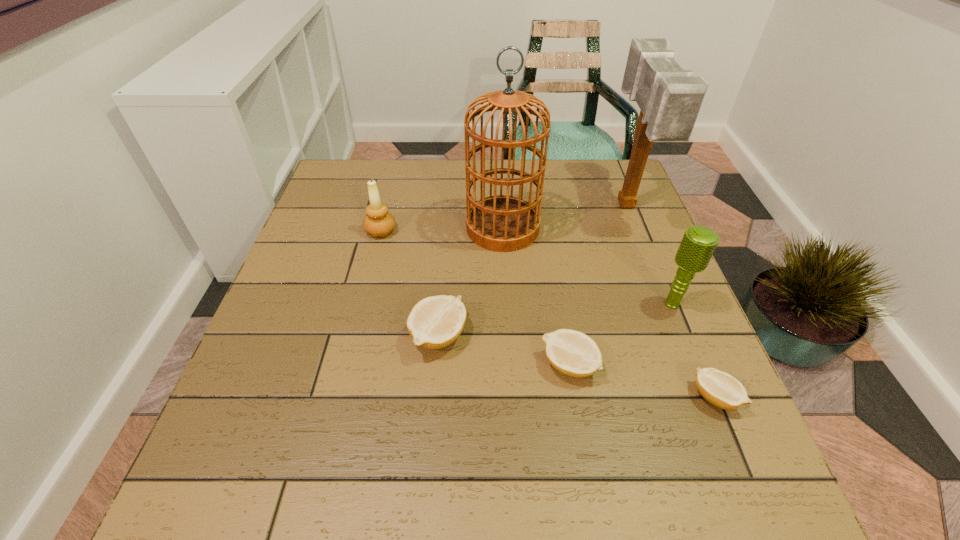
In the image, there is a desktop. Where is `blank space at the far right corner`? The width and height of the screenshot is (960, 540). blank space at the far right corner is located at coordinates (588, 171).

Find the location of a particular element. vacant region between the leftmost object and the second tallest lemon is located at coordinates (475, 298).

Where is `free area in between the rightmost lemon and the leftmost object`? free area in between the rightmost lemon and the leftmost object is located at coordinates (548, 314).

Identify the location of vacant area that lies between the shortest object and the leftmost object. (548, 314).

The height and width of the screenshot is (540, 960). What are the coordinates of `free space between the shortest lemon and the third tallest object` in the screenshot? It's located at (694, 351).

You are a GUI agent. You are given a task and a screenshot of the screen. Output one action in this format:
    pyautogui.click(x=<x>, y=<y>)
    Task: Click on the unoccupied position between the second tallest lemon and the leftmost object
    
    Given the screenshot: What is the action you would take?
    pyautogui.click(x=475, y=298)

In order to click on vacant space that's between the shortest object and the fourth tallest object in this screenshot , I will do `click(548, 314)`.

This screenshot has width=960, height=540. What are the coordinates of `free space that is in between the birdcage and the candle_holder` in the screenshot? It's located at (442, 230).

Where is `blank region between the birdcage and the tallest lemon`? The height and width of the screenshot is (540, 960). blank region between the birdcage and the tallest lemon is located at coordinates (470, 282).

This screenshot has width=960, height=540. Identify the location of free space between the birdcage and the second tallest lemon. (536, 296).